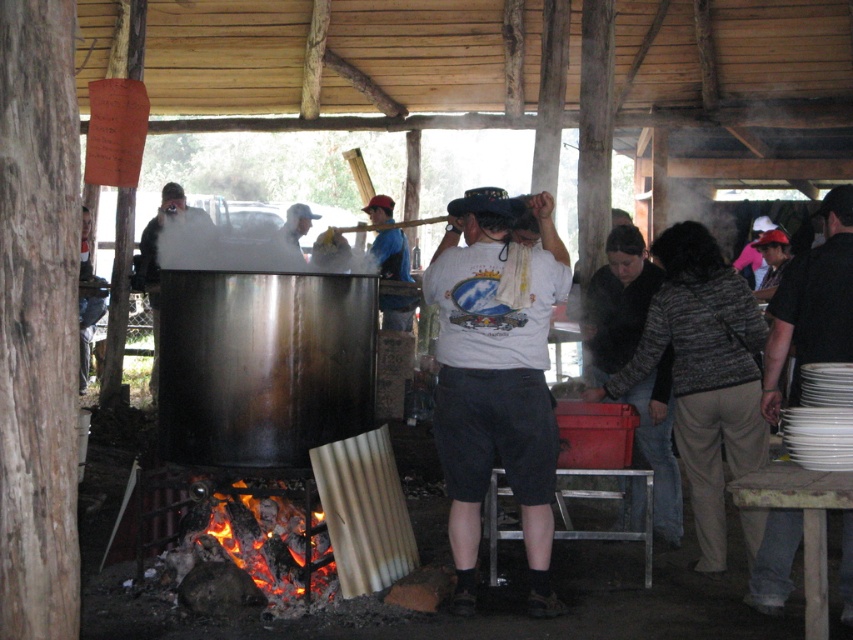
Between black fabric shirt at right and charcoal wood fire at lower left, which one is positioned higher?

Positioned higher is black fabric shirt at right.

Locate an element on the screen. The width and height of the screenshot is (853, 640). black fabric shirt at right is located at coordinates (811, 305).

Who is more forward, (849, 337) or (253, 544)?

Point (849, 337) is in front.

You are a GUI agent. You are given a task and a screenshot of the screen. Output one action in this format:
    pyautogui.click(x=<x>, y=<y>)
    Task: Click on the black fabric shirt at right
    
    Given the screenshot: What is the action you would take?
    pyautogui.click(x=811, y=305)

Does white t-shirt at center have a greater height compared to charcoal wood fire at lower left?

Indeed, white t-shirt at center has a greater height compared to charcoal wood fire at lower left.

Is the position of white t-shirt at center less distant than that of charcoal wood fire at lower left?

Yes, it is in front of charcoal wood fire at lower left.

Find the location of `white t-shirt at center`. white t-shirt at center is located at coordinates (496, 378).

Image resolution: width=853 pixels, height=640 pixels. What do you see at coordinates (496, 378) in the screenshot?
I see `white t-shirt at center` at bounding box center [496, 378].

Find the location of a particular element. white t-shirt at center is located at coordinates (496, 378).